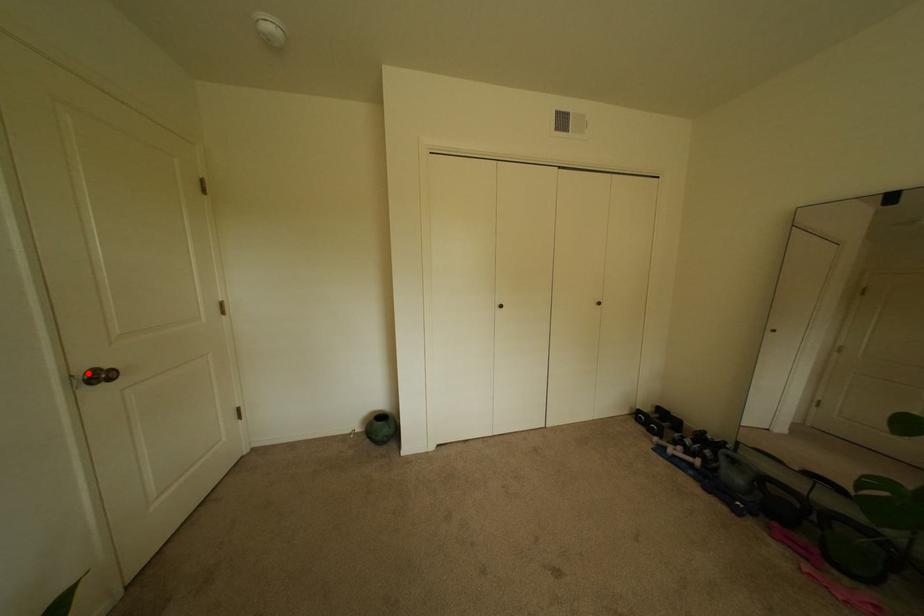
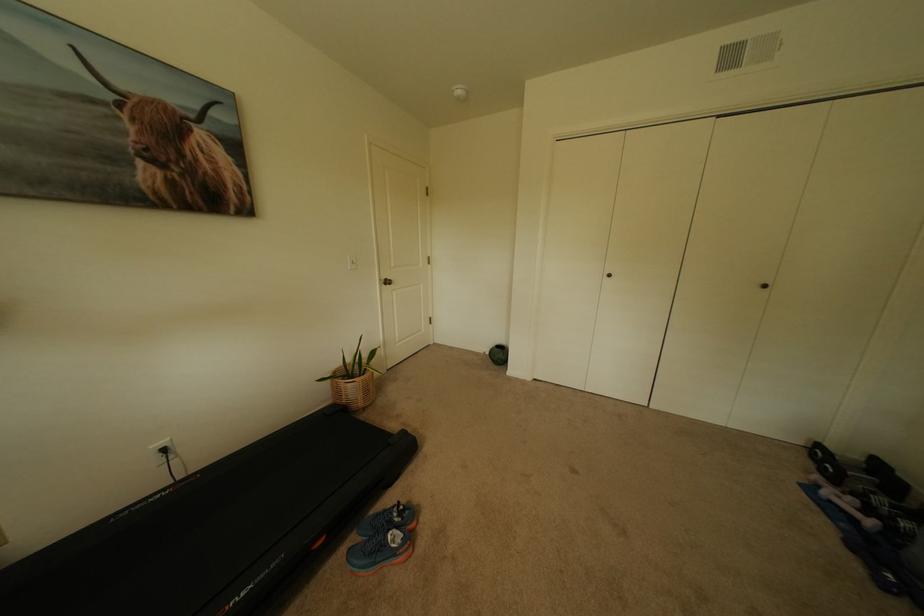
Question: A red point is marked in image1. In image2, is the corresponding 3D point closer to the camera or farther? Reply with the corresponding letter.

Choices:
 (A) The corresponding 3D point is closer.
 (B) The corresponding 3D point is farther.

Answer: (A)